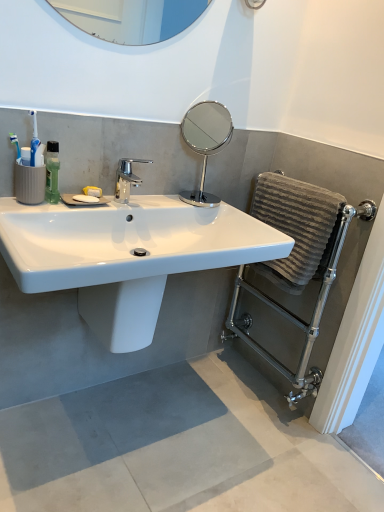
In order to face gray concrete floor at lower center, should I rotate leftwards or rightwards?

It's best to rotate left around 0.375 degrees.

Measure the distance between point [78,305] and camera.

Point [78,305] and camera are 1.47 meters apart from each other.

The height and width of the screenshot is (512, 384). What do you see at coordinates (126, 178) in the screenshot?
I see `polished chrome tap at center` at bounding box center [126, 178].

At what (x,y) coordinates should I click in order to perform the action: click on polished chrome mirror at center. Please return your answer as a coordinate pair (x, y). Looking at the image, I should click on (205, 142).

Are white glossy bidet at center and polished chrome mirror at center located far from each other?

white glossy bidet at center is far away from polished chrome mirror at center.

From the image's perspective, which object appears higher, white glossy bidet at center or polished chrome mirror at center?

polished chrome mirror at center.

Can you confirm if white glossy bidet at center is wider than polished chrome mirror at center?

Indeed, white glossy bidet at center has a greater width compared to polished chrome mirror at center.

Between polished chrome tap at center and gray concrete floor at lower center, which one has larger width?

Wider between the two is gray concrete floor at lower center.

Considering the positions of point (117, 195) and point (210, 495), is point (117, 195) closer or farther from the camera than point (210, 495)?

Point (117, 195) appears to be farther away from the viewer than point (210, 495).

Is polished chrome tap at center further to the viewer compared to gray concrete floor at lower center?

Yes, polished chrome tap at center is behind gray concrete floor at lower center.

From a real-world perspective, which object rests below the other?

gray concrete floor at lower center is physically lower.

Looking at this image, from the image's perspective, is white glossy bidet at center above white glossy sink at center?

No, from the image's perspective, white glossy bidet at center is not over white glossy sink at center.

From the picture: Can you confirm if white glossy bidet at center is positioned to the left of white glossy sink at center?

Correct, you'll find white glossy bidet at center to the left of white glossy sink at center.

Can you confirm if white glossy bidet at center is thinner than white glossy sink at center?

Correct, the width of white glossy bidet at center is less than that of white glossy sink at center.

Are white glossy bidet at center and white glossy sink at center located far from each other?

No, white glossy bidet at center is not far away from white glossy sink at center.

Which is behind, point (220, 110) or point (254, 251)?

The point (220, 110) is farther from the camera.

Considering the positions of objects polished chrome mirror at center and white glossy sink at center in the image provided, who is more to the right, polished chrome mirror at center or white glossy sink at center?

polished chrome mirror at center is more to the right.

Is the depth of polished chrome mirror at center greater than that of white glossy sink at center?

Yes, it is behind white glossy sink at center.

Is white glossy sink at center touching gray concrete floor at lower center?

No, white glossy sink at center is not with gray concrete floor at lower center.

What are the coordinates of `concrete in front of the white glossy sink at center` in the screenshot? It's located at (177, 448).

Does white glossy sink at center have a larger size compared to gray concrete floor at lower center?

Correct, white glossy sink at center is larger in size than gray concrete floor at lower center.

From the image's perspective, is white glossy sink at center located above gray concrete floor at lower center?

Indeed, from the image's perspective, white glossy sink at center is shown above gray concrete floor at lower center.

Does point (237, 374) come closer to viewer compared to point (202, 181)?

No, it is not.

How far apart are gray concrete floor at lower center and polished chrome mirror at center?

gray concrete floor at lower center and polished chrome mirror at center are 4.89 feet apart from each other.

Based on their positions, is gray concrete floor at lower center located to the left or right of polished chrome mirror at center?

From the image, it's evident that gray concrete floor at lower center is to the left of polished chrome mirror at center.

Who is taller, gray concrete floor at lower center or polished chrome mirror at center?

polished chrome mirror at center.

Consider the image. Considering the sizes of objects white glossy sink at center and polished chrome mirror at center in the image provided, who is bigger, white glossy sink at center or polished chrome mirror at center?

white glossy sink at center.

From the picture: From the image's perspective, is white glossy sink at center located above or below polished chrome mirror at center?

Based on their image positions, white glossy sink at center is located beneath polished chrome mirror at center.

Which object is closer to the camera taking this photo, white glossy sink at center or polished chrome mirror at center?

white glossy sink at center is closer to the camera.

What's the angular difference between white glossy sink at center and polished chrome mirror at center's facing directions?

1.82 degrees.

I want to click on bidet in front of the polished chrome mirror at center, so click(x=123, y=312).

Where is `tap lying above the gray concrete floor at lower center (from the image's perspective)`? Image resolution: width=384 pixels, height=512 pixels. tap lying above the gray concrete floor at lower center (from the image's perspective) is located at coordinates (126, 178).

When comparing their distances from polished chrome tap at center, does gray textured towel at right or polished chrome mirror at center seem closer?

gray textured towel at right is positioned closer to the anchor polished chrome tap at center.

From the image, which object appears to be farther from green matte bottle at left, polished chrome mirror at center or polished chrome tap at center?

polished chrome mirror at center is positioned further to the anchor green matte bottle at left.

Which object lies further to the anchor point gray textured towel at right, white glossy sink at center or green matte bottle at left?

green matte bottle at left is further to gray textured towel at right.

Looking at the image, which one is located closer to gray textured towel at right, polished chrome mirror at center or white glossy bidet at center?

white glossy bidet at center lies closer to gray textured towel at right than the other object.

Consider the image. Estimate the real-world distances between objects in this image. Which object is closer to polished chrome mirror at center, gray concrete floor at lower center or green matte bottle at left?

Among the two, green matte bottle at left is located nearer to polished chrome mirror at center.

Which object lies further to the anchor point gray concrete floor at lower center, polished chrome tap at center or green matte bottle at left?

Among the two, green matte bottle at left is located further to gray concrete floor at lower center.

Which object lies further to the anchor point white glossy bidet at center, white glossy sink at center or polished chrome tap at center?

polished chrome tap at center is positioned further to the anchor white glossy bidet at center.

Based on their spatial positions, is green matte bottle at left or polished chrome mirror at center further from gray textured towel at right?

Among the two, polished chrome mirror at center is located further to gray textured towel at right.

The height and width of the screenshot is (512, 384). What are the coordinates of `tap between green matte bottle at left and gray textured towel at right from left to right` in the screenshot? It's located at (126, 178).

I want to click on sink that lies between gray textured towel at right and gray concrete floor at lower center from top to bottom, so click(x=127, y=255).

Find the location of a particular element. The image size is (384, 512). bath towel between green matte bottle at left and gray concrete floor at lower center in the vertical direction is located at coordinates (297, 227).

What are the coordinates of `sink between polished chrome mirror at center and white glossy bidet at center in the up-down direction` in the screenshot? It's located at (127, 255).